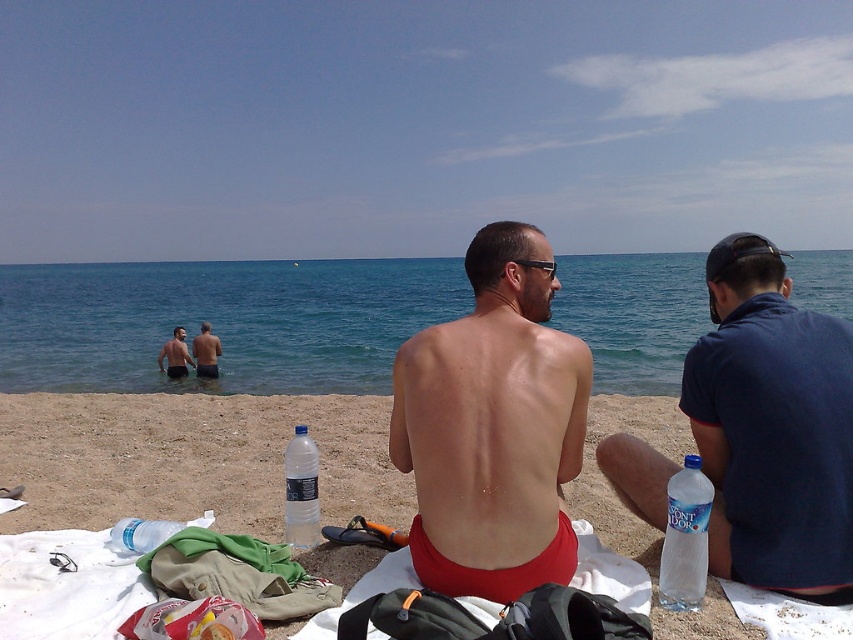
You are a lifeguard on duty and notice two clear plastic bottles on the beach towel. You need to inform visitors about the height difference between the clear plastic bottle at lower right and the clear plastic bottle at lower left. What should you tell them?

The clear plastic bottle at lower right is much taller than the clear plastic bottle at lower left.

From the picture: You are a photographer wanting to capture both the matte red shorts at center and the smooth skin man at center in the same frame. Since the camera has a fixed focus that can only clearly capture objects of the same height, will you be able to do so?

The matte red shorts at center is much taller than the smooth skin man at center, so they are not the same height. Therefore, the camera cannot clearly capture both in the same frame because their heights differ significantly.